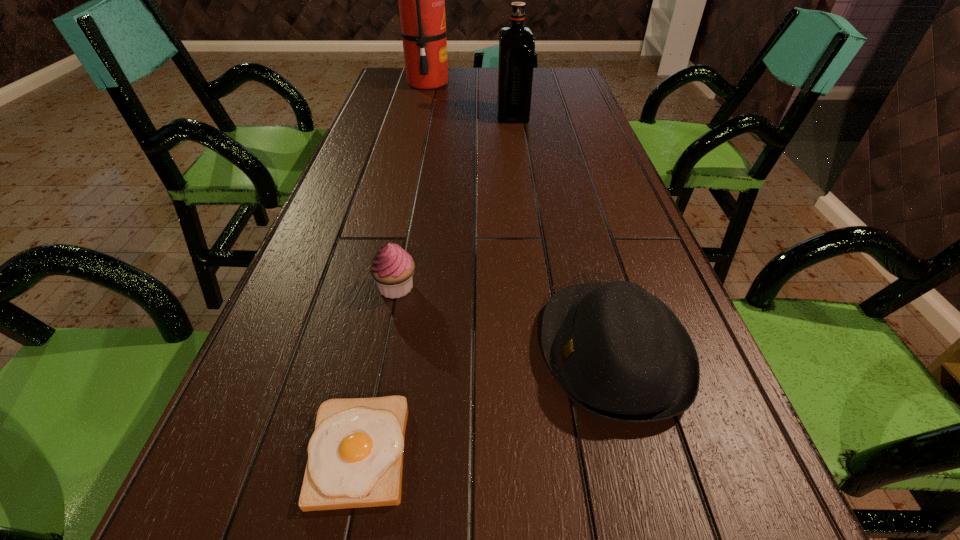
At what (x,y) coordinates should I click in order to perform the action: click on the farthest object. Please return your answer as a coordinate pair (x, y). The height and width of the screenshot is (540, 960). Looking at the image, I should click on (421, 0).

This screenshot has width=960, height=540. Identify the location of fire extinguisher. (421, 0).

This screenshot has height=540, width=960. Identify the location of the second tallest object. (516, 43).

Where is `the second farthest object`? the second farthest object is located at coordinates (516, 43).

You are a GUI agent. You are given a task and a screenshot of the screen. Output one action in this format:
    pyautogui.click(x=<x>, y=<y>)
    Task: Click on the fedora
    The image size is (960, 540).
    Given the screenshot: What is the action you would take?
    pyautogui.click(x=618, y=352)

Locate an element on the screen. The height and width of the screenshot is (540, 960). cupcake is located at coordinates (392, 267).

I want to click on the shortest object, so click(x=355, y=455).

Where is `free location located on the side of the farthest object with the nozzle and handle`? free location located on the side of the farthest object with the nozzle and handle is located at coordinates (465, 83).

Identify the location of blank space located 0.150m on the front label of the liquor. This screenshot has height=540, width=960. (452, 116).

Locate an element on the screen. Image resolution: width=960 pixels, height=540 pixels. vacant region located on the front label of the liquor is located at coordinates (437, 116).